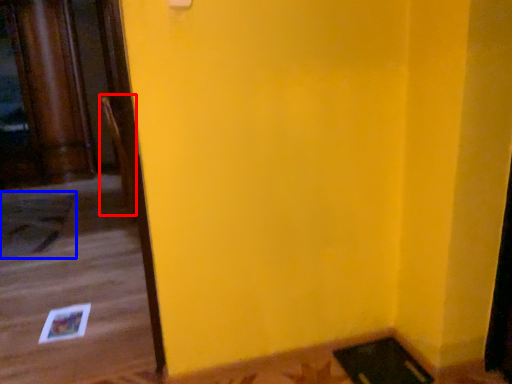
Question: Which object appears closest to the camera in this image, chair (highlighted by a red box) or doormat (highlighted by a blue box)?

Choices:
 (A) chair
 (B) doormat

Answer: (B)